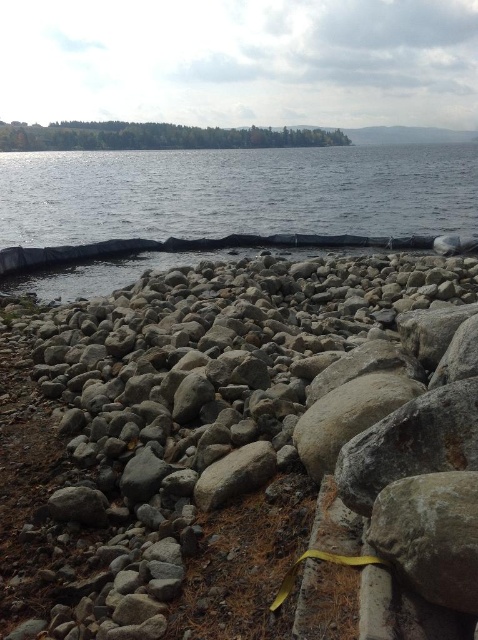
Question: Does gray rock shoreline at lower left lie in front of clear water at center?

Choices:
 (A) yes
 (B) no

Answer: (A)

Question: Can you confirm if gray rock shoreline at lower left is thinner than clear water at center?

Choices:
 (A) yes
 (B) no

Answer: (A)

Question: Is gray rock shoreline at lower left behind clear water at center?

Choices:
 (A) yes
 (B) no

Answer: (B)